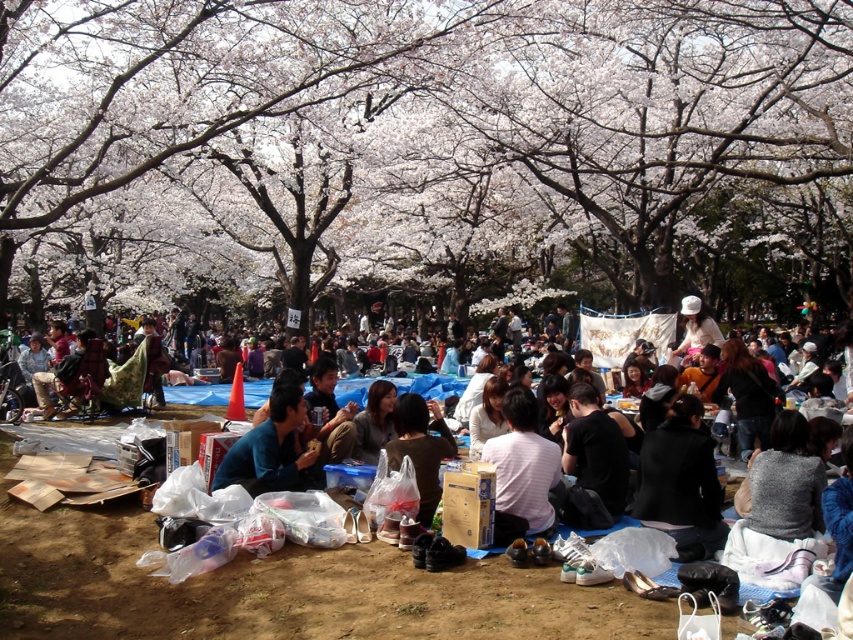
From the picture: Between striped cotton shirt at center and blue fabric at center, which one appears on the right side from the viewer's perspective?

striped cotton shirt at center

Does point (523, 429) lie behind point (262, 440)?

No, (523, 429) is in front of (262, 440).

Find the location of `striped cotton shirt at center`. striped cotton shirt at center is located at coordinates (521, 465).

Can you confirm if white blossoms at center is thinner than blue fabric at center?

No, white blossoms at center is not thinner than blue fabric at center.

Is point (120, 26) less distant than point (280, 445)?

No, (120, 26) is further to viewer.

You are a GUI agent. You are given a task and a screenshot of the screen. Output one action in this format:
    pyautogui.click(x=<x>, y=<y>)
    Task: Click on the white blossoms at center
    
    Given the screenshot: What is the action you would take?
    pyautogui.click(x=424, y=157)

Does white blossoms at center have a greater width compared to striped cotton shirt at center?

Correct, the width of white blossoms at center exceeds that of striped cotton shirt at center.

Is point (814, 42) closer to camera compared to point (508, 474)?

No, it is behind (508, 474).

Where is `white blossoms at center`? white blossoms at center is located at coordinates (424, 157).